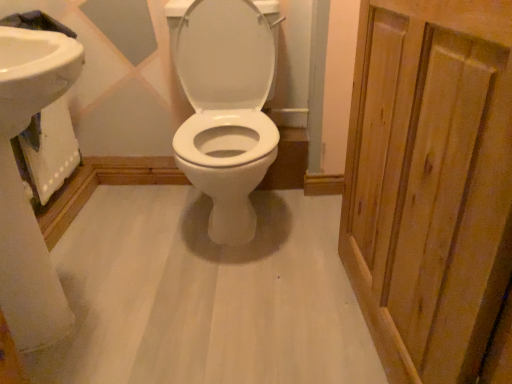
Question: Considering the relative positions of white glossy sink at left and white glossy toilet at center in the image provided, is white glossy sink at left in front of white glossy toilet at center?

Choices:
 (A) yes
 (B) no

Answer: (A)

Question: Can you confirm if white glossy sink at left is positioned to the right of white glossy toilet at center?

Choices:
 (A) yes
 (B) no

Answer: (B)

Question: From a real-world perspective, is white glossy sink at left physically below white glossy toilet at center?

Choices:
 (A) no
 (B) yes

Answer: (A)

Question: From the image's perspective, is white glossy sink at left beneath white glossy toilet at center?

Choices:
 (A) no
 (B) yes

Answer: (B)

Question: Can you confirm if white glossy sink at left is thinner than white glossy toilet at center?

Choices:
 (A) no
 (B) yes

Answer: (B)

Question: Does white glossy sink at left appear on the left side of white glossy toilet at center?

Choices:
 (A) yes
 (B) no

Answer: (A)

Question: Is the depth of natural wood screen door at right less than that of white glossy sink at left?

Choices:
 (A) no
 (B) yes

Answer: (B)

Question: From a real-world perspective, is natural wood screen door at right located beneath white glossy sink at left?

Choices:
 (A) no
 (B) yes

Answer: (A)

Question: Is natural wood screen door at right thinner than white glossy sink at left?

Choices:
 (A) yes
 (B) no

Answer: (A)

Question: From a real-world perspective, does natural wood screen door at right stand above white glossy sink at left?

Choices:
 (A) no
 (B) yes

Answer: (B)

Question: Does natural wood screen door at right appear on the right side of white glossy sink at left?

Choices:
 (A) no
 (B) yes

Answer: (B)

Question: Could you tell me if natural wood screen door at right is facing white glossy sink at left?

Choices:
 (A) no
 (B) yes

Answer: (B)

Question: Is the position of natural wood screen door at right more distant than that of white glossy toilet at center?

Choices:
 (A) yes
 (B) no

Answer: (B)